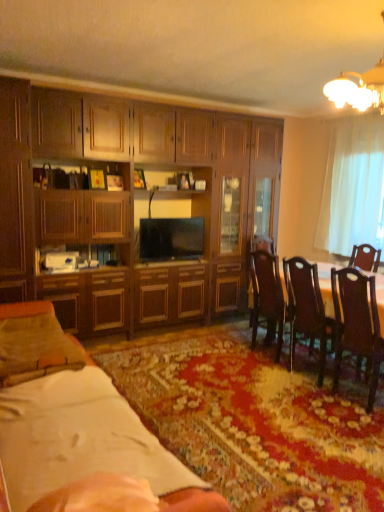
Question: Considering the relative positions of dark wood chair at right, which is counted as the 1th chair, starting from the right, and white paper at lower left in the image provided, is dark wood chair at right, which is counted as the 1th chair, starting from the right, behind white paper at lower left?

Choices:
 (A) no
 (B) yes

Answer: (B)

Question: Considering the relative positions of dark wood chair at right, acting as the 2th chair starting from the left, and white paper at lower left in the image provided, is dark wood chair at right, acting as the 2th chair starting from the left, to the left of white paper at lower left from the viewer's perspective?

Choices:
 (A) no
 (B) yes

Answer: (A)

Question: Considering the relative sizes of dark wood chair at right, the second chair viewed from the back, and white paper at lower left in the image provided, is dark wood chair at right, the second chair viewed from the back, thinner than white paper at lower left?

Choices:
 (A) no
 (B) yes

Answer: (B)

Question: Is white paper at lower left located within dark wood chair at right, the second chair viewed from the back?

Choices:
 (A) yes
 (B) no

Answer: (B)

Question: Is dark wood chair at right, the 1th chair viewed from the front, not near white paper at lower left?

Choices:
 (A) no
 (B) yes

Answer: (B)

Question: From a real-world perspective, is dark wood chair at right, the second chair viewed from the back, physically above white paper at lower left?

Choices:
 (A) no
 (B) yes

Answer: (B)

Question: Does dark wood chair at right, the 1th chair viewed from the front, have a greater width compared to brown wooden table at right?

Choices:
 (A) yes
 (B) no

Answer: (B)

Question: From the image's perspective, would you say dark wood chair at right, the 1th chair viewed from the front, is shown under brown wooden table at right?

Choices:
 (A) yes
 (B) no

Answer: (A)

Question: Considering the relative sizes of dark wood chair at right, the 1th chair viewed from the front, and brown wooden table at right in the image provided, is dark wood chair at right, the 1th chair viewed from the front, bigger than brown wooden table at right?

Choices:
 (A) yes
 (B) no

Answer: (B)

Question: Does dark wood chair at right, acting as the 2th chair starting from the left, have a lesser width compared to brown wooden table at right?

Choices:
 (A) yes
 (B) no

Answer: (A)

Question: Can we say dark wood chair at right, the 1th chair viewed from the front, lies outside brown wooden table at right?

Choices:
 (A) yes
 (B) no

Answer: (A)

Question: Would you consider dark wood chair at right, acting as the 2th chair starting from the left, to be distant from brown wooden table at right?

Choices:
 (A) no
 (B) yes

Answer: (A)

Question: Is matte wood cabinet at left, the 2th cabinetry viewed from the right, looking in the opposite direction of wooden dining table at center?

Choices:
 (A) yes
 (B) no

Answer: (B)